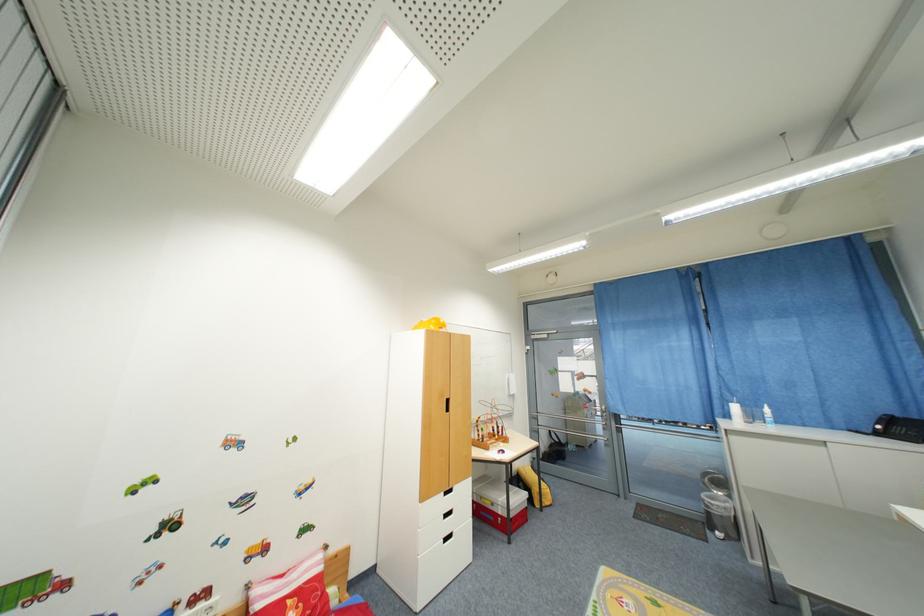
This screenshot has height=616, width=924. Identify the location of white pump bottle. (736, 411).